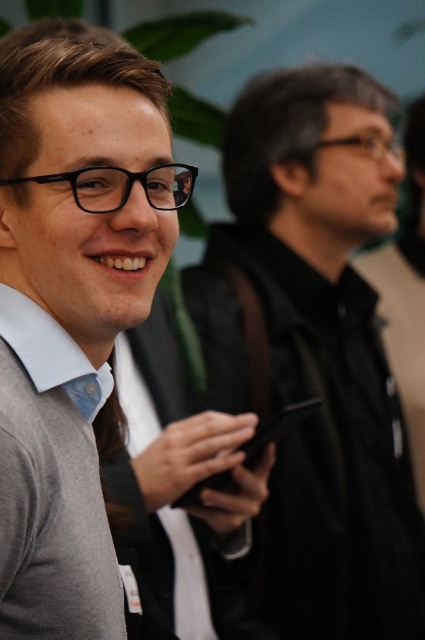
Question: Can you confirm if black matte jacket at center is positioned to the right of gray sweater at left?

Choices:
 (A) yes
 (B) no

Answer: (A)

Question: Which point is closer to the camera taking this photo?

Choices:
 (A) (336, 304)
 (B) (107, 618)

Answer: (B)

Question: Which of the following is the farthest from the observer?

Choices:
 (A) gray sweater at left
 (B) black matte jacket at center
 (C) black matte smartphone at center

Answer: (B)

Question: Can you confirm if gray sweater at left is positioned below black matte smartphone at center?

Choices:
 (A) yes
 (B) no

Answer: (B)

Question: Considering the relative positions of black matte jacket at center and gray sweater at left in the image provided, where is black matte jacket at center located with respect to gray sweater at left?

Choices:
 (A) above
 (B) below

Answer: (B)

Question: Among these points, which one is farthest from the camera?

Choices:
 (A) (73, 492)
 (B) (354, 340)
 (C) (215, 474)

Answer: (B)